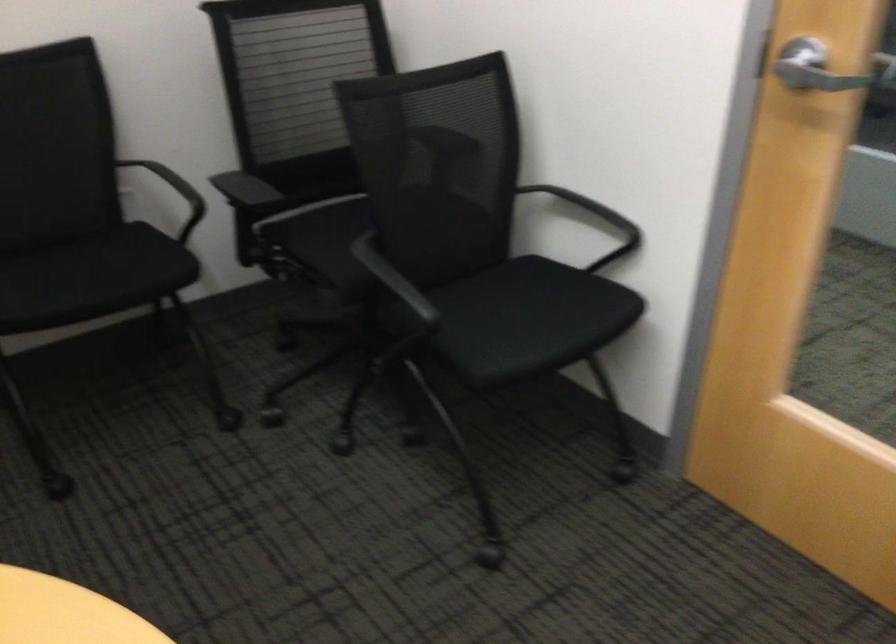
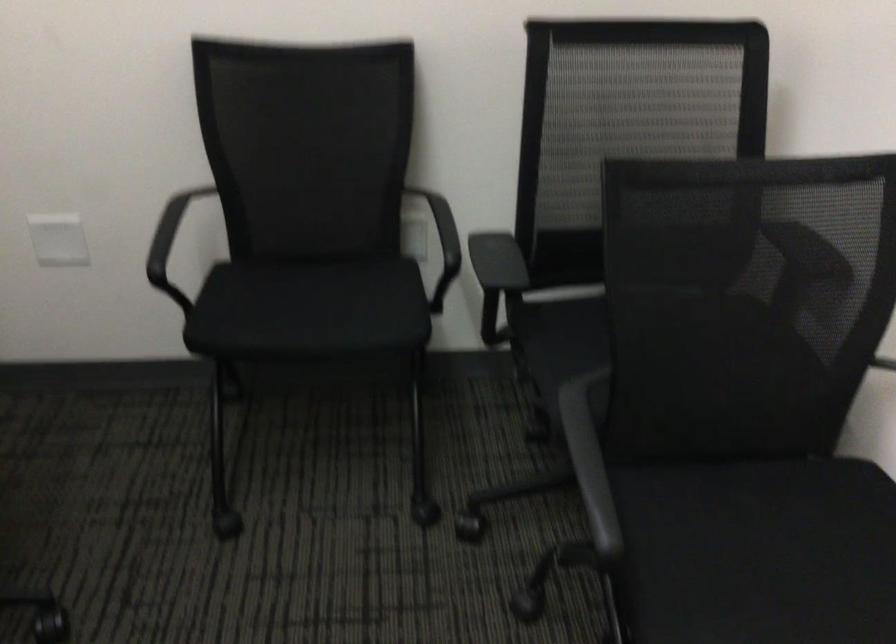
Question: The camera is either moving clockwise (left) or counter-clockwise (right) around the object. The first image is from the beginning of the video and the second image is from the end. Is the camera moving left or right when shooting the video?

Choices:
 (A) Left
 (B) Right

Answer: (B)